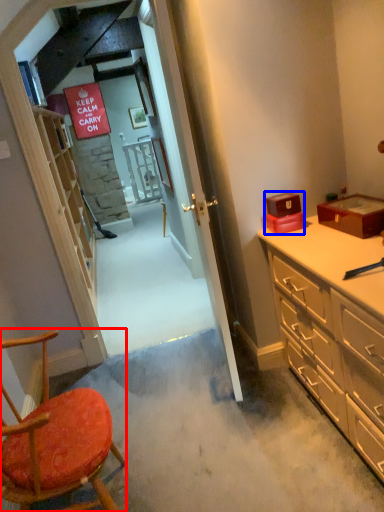
Question: Which point is closer to the camera, chair (highlighted by a red box) or box (highlighted by a blue box)?

Choices:
 (A) chair
 (B) box

Answer: (A)